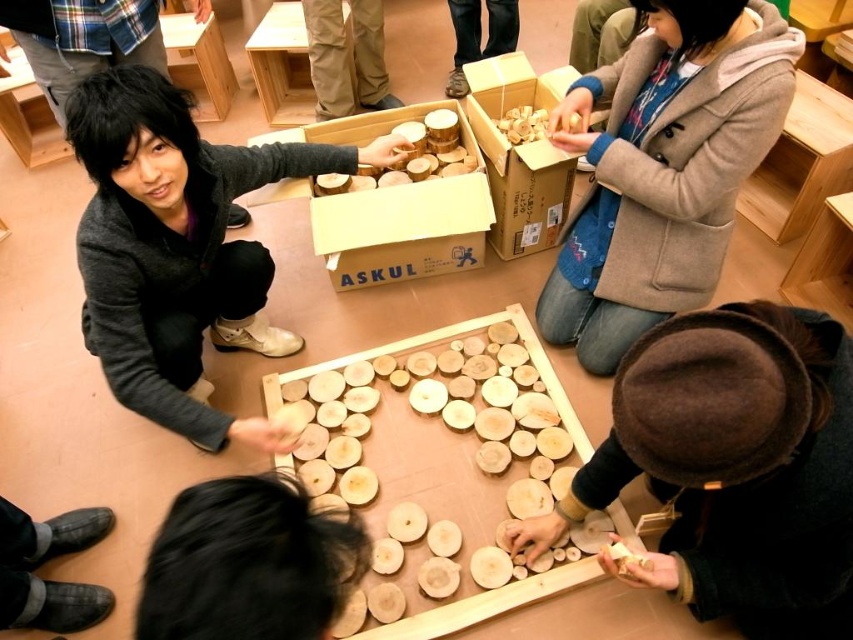
You are a participant in the activity and need to place an object from the natural wood box at center into your matte gray jacket at lower left. Is the opening of your jacket large enough to fit the object from the box?

The matte gray jacket at lower left is below natural wood box at center, so the jacket is positioned lower than the box. However, the size compatibility between the jacket opening and the object from the box cannot be determined from the given information.

Consider the image. You are standing at the origin point in the scene. Which direction should you move to reach the matte gray jacket at lower left?

Since the matte gray jacket at lower left is located at point 0.384 on the x and 0.209 on the y, you should move towards the lower left direction to reach it.

You are standing at the origin point in the scene. The coordinates given are relative to the image frame. Where is the matte gray jacket at lower left positioned in relation to the origin?

The matte gray jacket at lower left is positioned at coordinates point (177,244) relative to the origin, meaning it is located to the right and above the origin point.